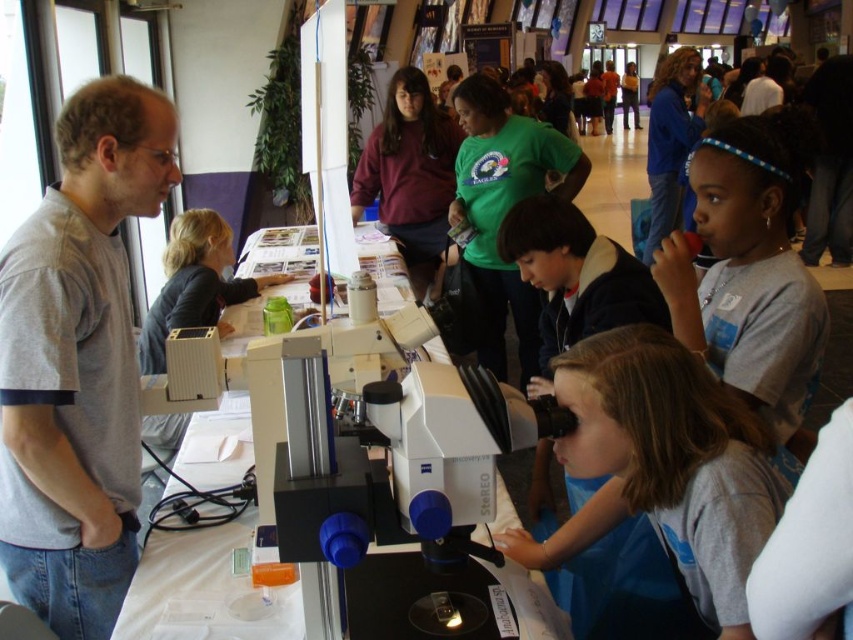
Between gray cotton shirt at left and white plastic microscope at center, which one is positioned lower?

white plastic microscope at center is below.

Can you confirm if gray cotton shirt at left is positioned above white plastic microscope at center?

Yes.

Does point (0, 396) come in front of point (473, 380)?

No, (0, 396) is behind (473, 380).

You are a GUI agent. You are given a task and a screenshot of the screen. Output one action in this format:
    pyautogui.click(x=<x>, y=<y>)
    Task: Click on the gray cotton shirt at left
    The height and width of the screenshot is (640, 853).
    Given the screenshot: What is the action you would take?
    pyautogui.click(x=78, y=362)

Does gray cotton shirt at left have a greater width compared to light brown hair at center?

Incorrect, gray cotton shirt at left's width does not surpass light brown hair at center's.

Between point (128, 305) and point (718, 524), which one is positioned in front?

Point (718, 524) is more forward.

Where is `gray cotton shirt at left`? The height and width of the screenshot is (640, 853). gray cotton shirt at left is located at coordinates (78, 362).

Is white plastic microscope at center positioned before light brown hair at center?

Yes, it is in front of light brown hair at center.

Does white plastic microscope at center appear over light brown hair at center?

No.

Is point (517, 605) positioned after point (641, 396)?

Yes, point (517, 605) is behind point (641, 396).

Locate an element on the screen. white plastic microscope at center is located at coordinates (392, 497).